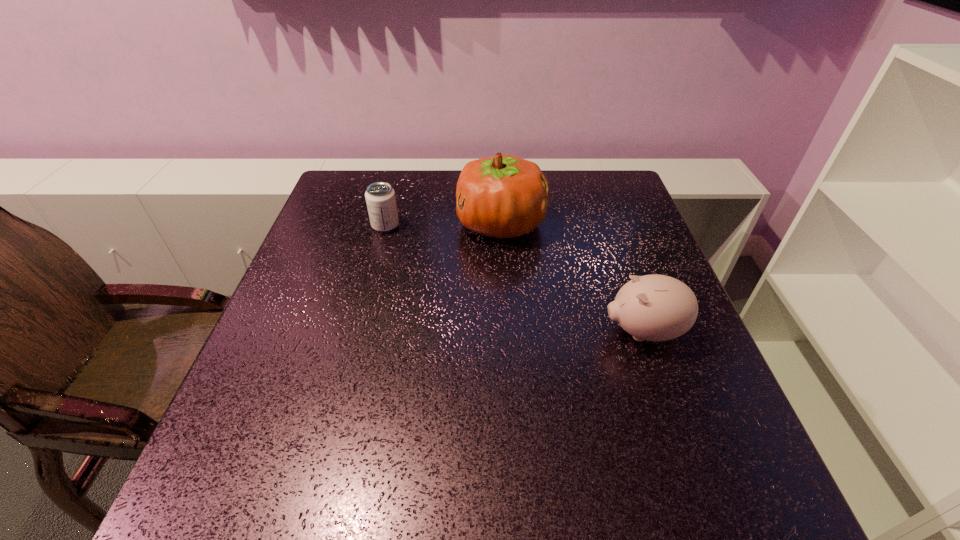
I want to click on the second object from right to left, so click(x=504, y=196).

Image resolution: width=960 pixels, height=540 pixels. Identify the location of the tallest object. (504, 196).

You are a GUI agent. You are given a task and a screenshot of the screen. Output one action in this format:
    pyautogui.click(x=<x>, y=<y>)
    Task: Click on the piggy bank
    The image size is (960, 540).
    Given the screenshot: What is the action you would take?
    pyautogui.click(x=654, y=307)

The image size is (960, 540). Identify the location of the nearest object. (654, 307).

Find the location of a particular element. The width and height of the screenshot is (960, 540). the shortest object is located at coordinates pos(380,197).

Locate an element on the screen. the leftmost object is located at coordinates (380, 197).

In order to click on vacant space located 0.330m on the side of the pumpkin with the cute face in this screenshot , I will do `click(336, 224)`.

I want to click on vacant area situated 0.090m on the side of the pumpkin with the cute face, so click(424, 224).

Where is `vacant region located 0.360m on the side of the pumpkin with the cute face`? The width and height of the screenshot is (960, 540). vacant region located 0.360m on the side of the pumpkin with the cute face is located at coordinates (324, 224).

Find the location of a particular element. The height and width of the screenshot is (540, 960). vacant region located at the snout of the second shortest object is located at coordinates (440, 332).